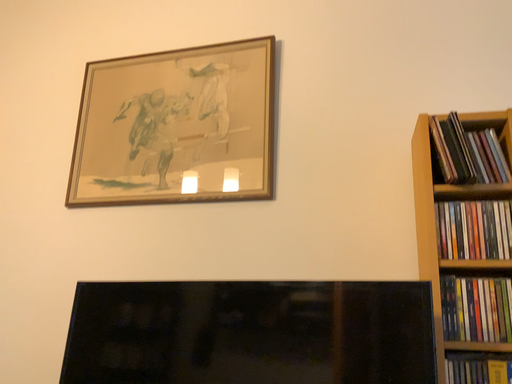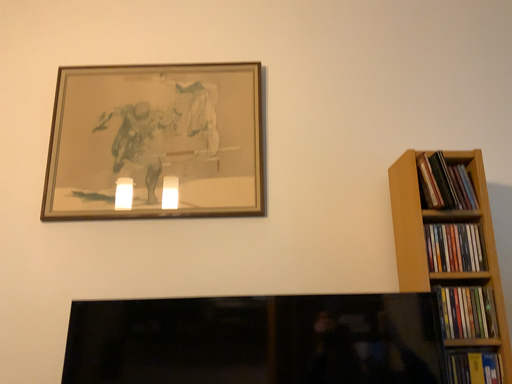
Question: How did the camera likely rotate when shooting the video?

Choices:
 (A) rotated left
 (B) rotated right

Answer: (B)